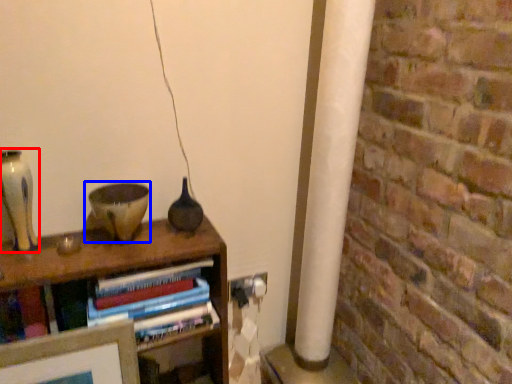
Question: Which object is further to the camera taking this photo, glass vase (highlighted by a red box) or candle holder (highlighted by a blue box)?

Choices:
 (A) glass vase
 (B) candle holder

Answer: (B)